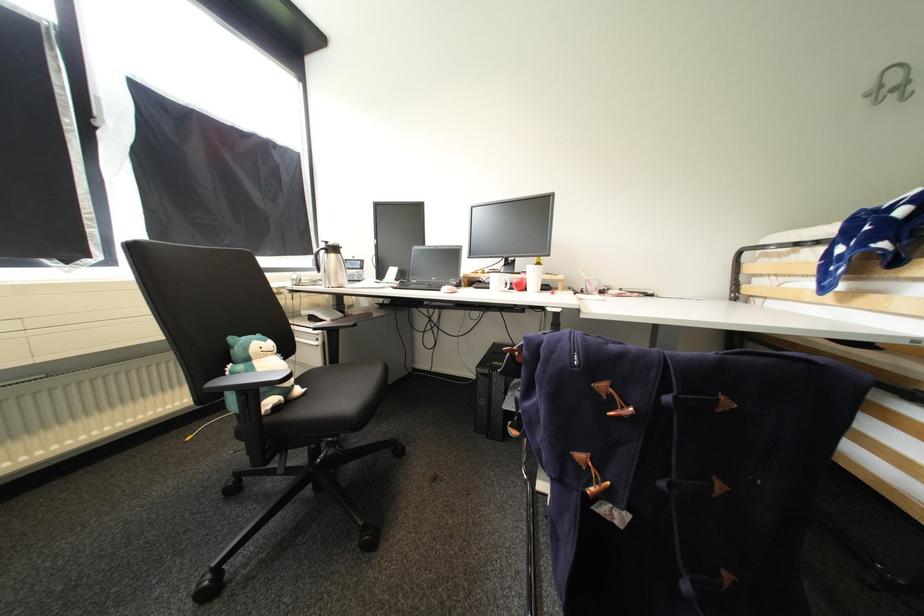
Locate an element on the screen. black chair sitting surface is located at coordinates (343, 387).